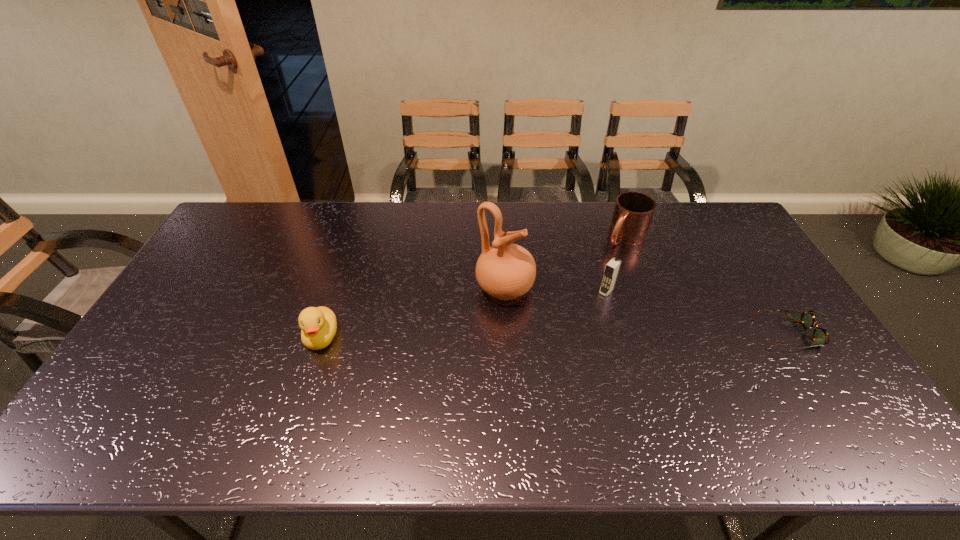
Locate an element on the screen. This screenshot has width=960, height=540. vacant region that satisfies the following two spatial constraints: 1. on the front side of the rightmost object; 2. on the front-facing side of the third object from left to right is located at coordinates (618, 334).

I want to click on vacant space that satisfies the following two spatial constraints: 1. on the back side of the second object from right to left; 2. on the right side of the tallest object, so tap(502, 236).

Where is `free space in the image that satisfies the following two spatial constraints: 1. on the front side of the spectacles; 2. on the front-facing side of the fourth object from right to left`? The width and height of the screenshot is (960, 540). free space in the image that satisfies the following two spatial constraints: 1. on the front side of the spectacles; 2. on the front-facing side of the fourth object from right to left is located at coordinates pyautogui.click(x=507, y=334).